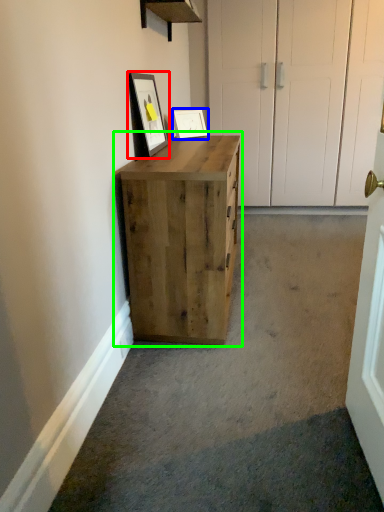
Question: Which object is positioned closest to picture frame (highlighted by a red box)? Select from picture frame (highlighted by a blue box) and chest of drawers (highlighted by a green box).

Choices:
 (A) picture frame
 (B) chest of drawers

Answer: (A)